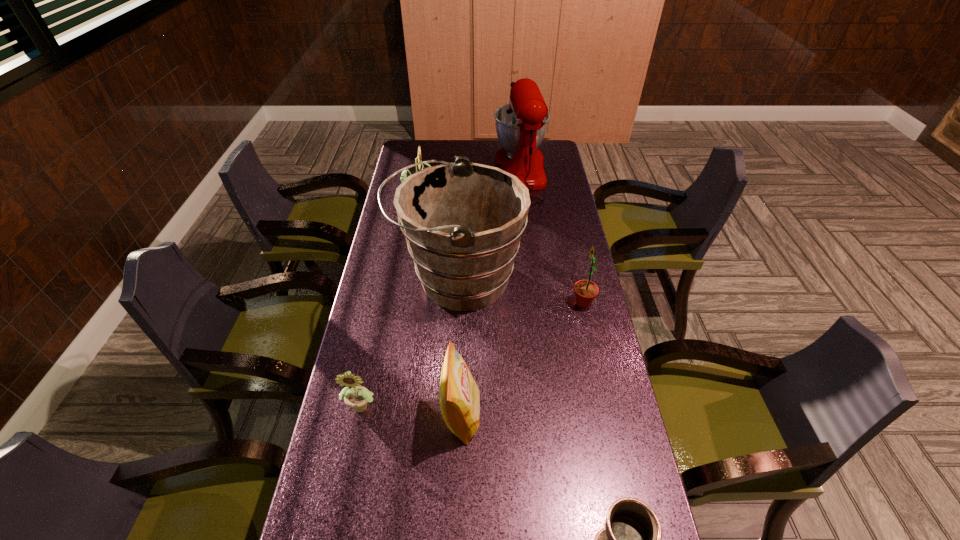
I want to click on vacant space located on the bowl side of the mixer, so click(x=446, y=174).

You are a GUI agent. You are given a task and a screenshot of the screen. Output one action in this format:
    pyautogui.click(x=<x>, y=<y>)
    Task: Click on the vacant space positioned 0.130m on the bowl side of the mixer
    
    Given the screenshot: What is the action you would take?
    pyautogui.click(x=444, y=174)

Find the location of a particular element. This screenshot has height=540, width=960. free spot located 0.050m on the handle side of the brown bucket is located at coordinates (379, 278).

Locate an element on the screen. This screenshot has height=540, width=960. blank space located on the handle side of the brown bucket is located at coordinates (371, 278).

At what (x,y) coordinates should I click in order to perform the action: click on vacant space positioned on the front-facing side of the farthest sunflower. Please return your answer as a coordinate pair (x, y). Image resolution: width=960 pixels, height=540 pixels. Looking at the image, I should click on (456, 198).

Identify the location of blank space located on the face of the second nearest sunflower. The height and width of the screenshot is (540, 960). (482, 303).

Identify the location of vacant position located on the face of the second nearest sunflower. This screenshot has width=960, height=540. (504, 303).

The width and height of the screenshot is (960, 540). What are the coordinates of `vacant space situated on the face of the second nearest sunflower` in the screenshot? It's located at (489, 303).

Find the location of a particular element. This screenshot has width=960, height=540. free space located 0.180m on the front-facing side of the crisp (potato chip) is located at coordinates (548, 416).

Identify the location of vacant position located 0.110m on the front-facing side of the nearer yellow sunflower. The width and height of the screenshot is (960, 540). (351, 462).